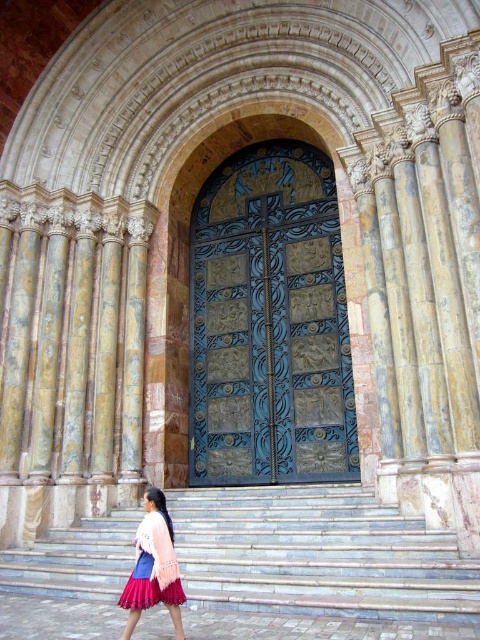
Question: Can you confirm if smooth stone stairs at center is positioned to the left of pink knitted sweater at lower left?

Choices:
 (A) no
 (B) yes

Answer: (A)

Question: Among these objects, which one is nearest to the camera?

Choices:
 (A) smooth stone stairs at center
 (B) pink knitted sweater at lower left

Answer: (B)

Question: Which of the following is the closest to the observer?

Choices:
 (A) pink knitted sweater at lower left
 (B) smooth stone stairs at center

Answer: (A)

Question: Is blue patinated metal door at center behind smooth stone stairs at center?

Choices:
 (A) no
 (B) yes

Answer: (B)

Question: Which point is farther to the camera?

Choices:
 (A) (298, 262)
 (B) (163, 556)

Answer: (A)

Question: Is blue patinated metal door at center wider than pink knitted sweater at lower left?

Choices:
 (A) yes
 (B) no

Answer: (A)